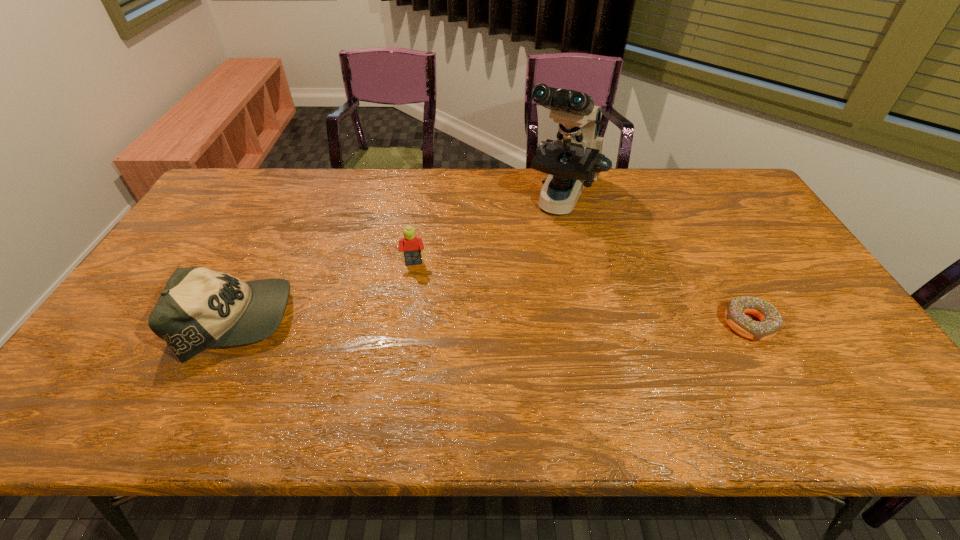
The width and height of the screenshot is (960, 540). I want to click on vacant space located through the eyepieces of the farthest object, so click(529, 278).

I want to click on free space located through the eyepieces of the farthest object, so click(x=536, y=265).

Where is `vacant space situated on the face of the third nearest object`? The height and width of the screenshot is (540, 960). vacant space situated on the face of the third nearest object is located at coordinates (417, 309).

Locate an element on the screen. The width and height of the screenshot is (960, 540). vacant region located on the face of the third nearest object is located at coordinates (418, 324).

This screenshot has height=540, width=960. Find the location of `vacant space located 0.120m on the face of the third nearest object`. vacant space located 0.120m on the face of the third nearest object is located at coordinates (417, 301).

Locate an element on the screen. object that is positioned at the far edge is located at coordinates (573, 161).

The height and width of the screenshot is (540, 960). What are the coordinates of `object present at the near edge` in the screenshot? It's located at (199, 308).

The width and height of the screenshot is (960, 540). I want to click on object at the left edge, so click(199, 308).

The image size is (960, 540). Identify the location of object that is at the near left corner. (199, 308).

Image resolution: width=960 pixels, height=540 pixels. What are the coordinates of `free space at the far edge` in the screenshot? It's located at (684, 173).